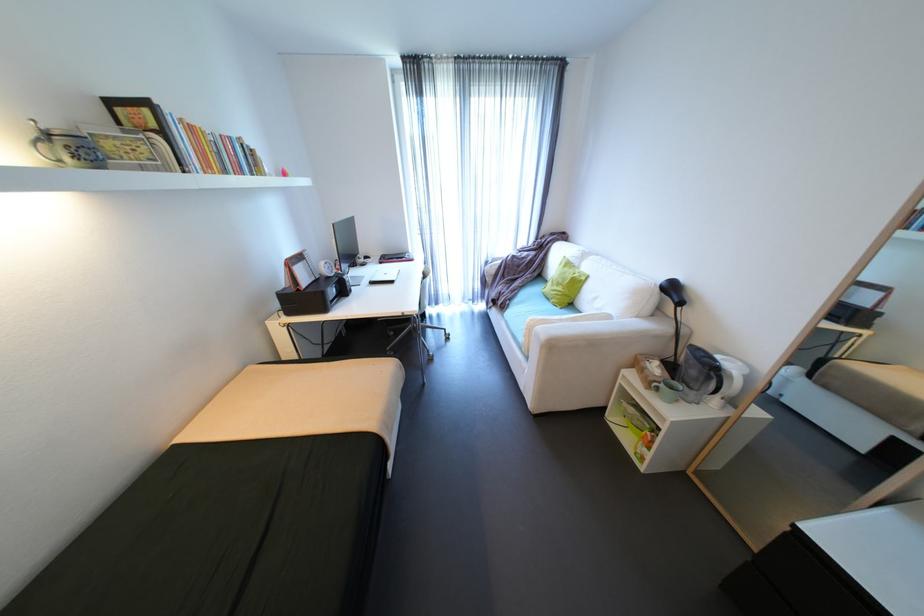
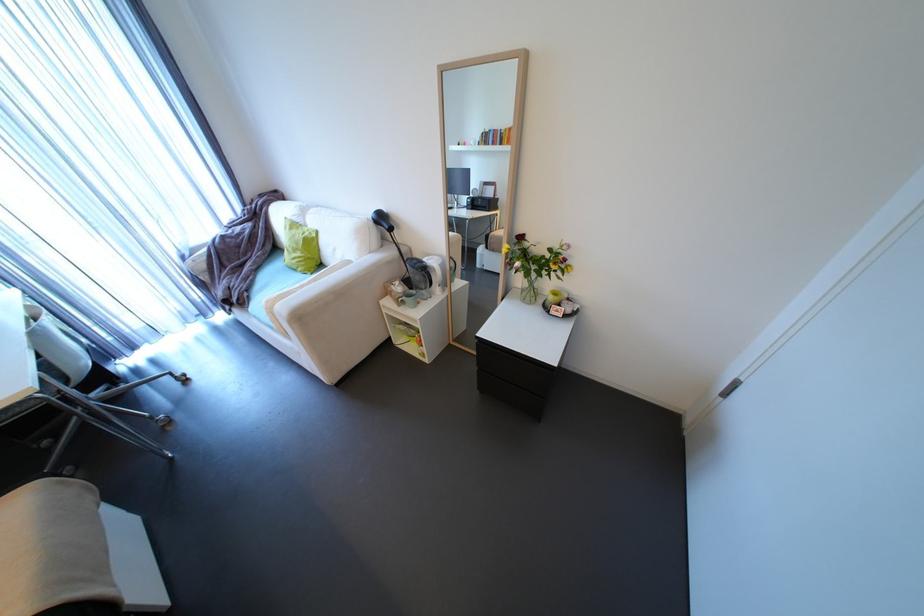
In the second image, find the point that corresponds to [568,309] in the first image.

(319, 274)